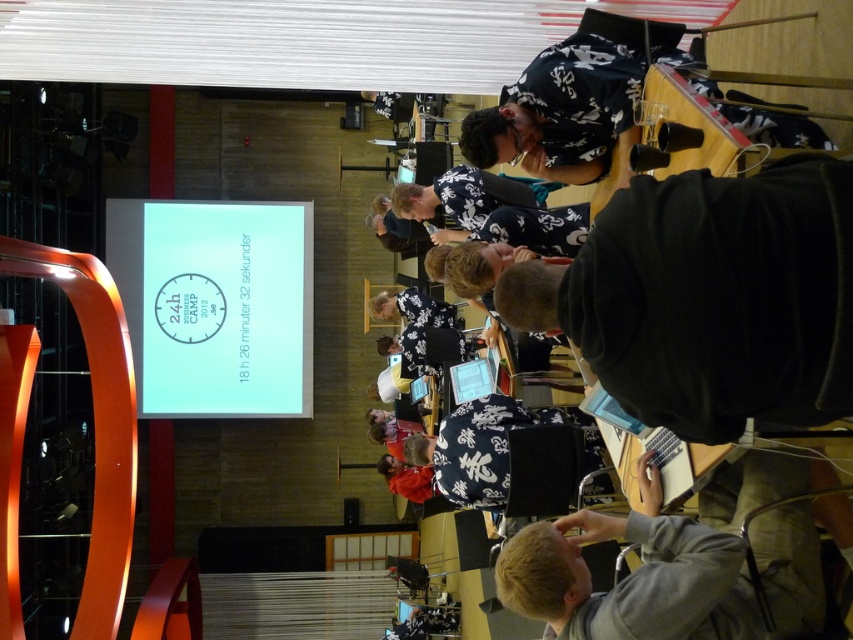
Question: Which object appears farthest from the camera in this image?

Choices:
 (A) floral fabric shirt at center
 (B) white glossy projection screen at upper left
 (C) red hoodie at center

Answer: (B)

Question: Does gray fabric at lower right lie in front of matte plastic screen at center?

Choices:
 (A) yes
 (B) no

Answer: (A)

Question: Which object is positioned farthest from the floral fabric shirt at center?

Choices:
 (A) gray fabric at lower right
 (B) matte plastic screen at center
 (C) black matte laptop at center
 (D) white glossy projection screen at upper left

Answer: (D)

Question: Is the position of floral fabric cap at center less distant than that of red hoodie at center?

Choices:
 (A) no
 (B) yes

Answer: (B)

Question: Is white glossy projection screen at upper left bigger than floral fabric cap at center?

Choices:
 (A) yes
 (B) no

Answer: (A)

Question: Estimate the real-world distances between objects in this image. Which object is farther from the gray fabric at lower right?

Choices:
 (A) floral fabric shirt at center
 (B) white glossy projection screen at upper left
 (C) floral fabric cap at center
 (D) black matte laptop at center

Answer: (B)